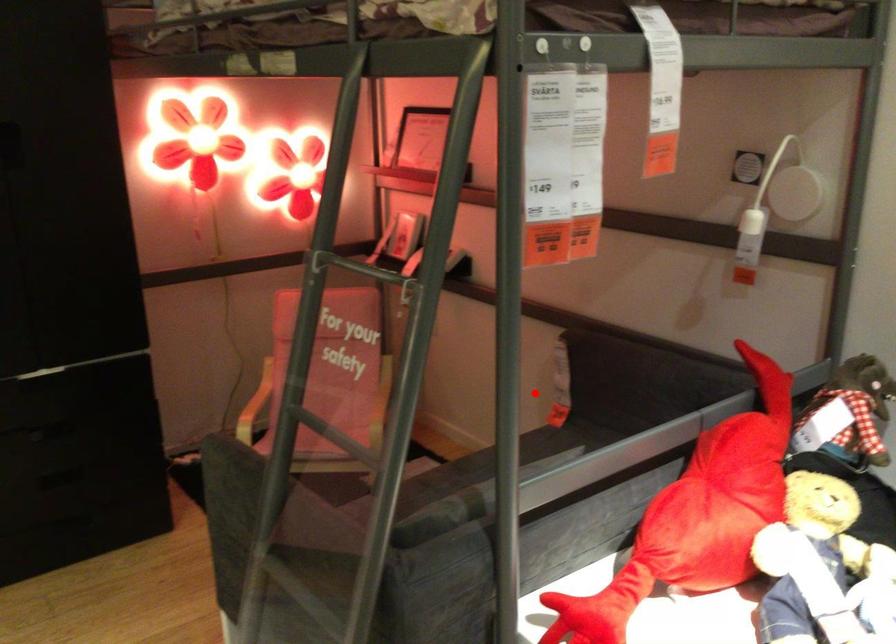
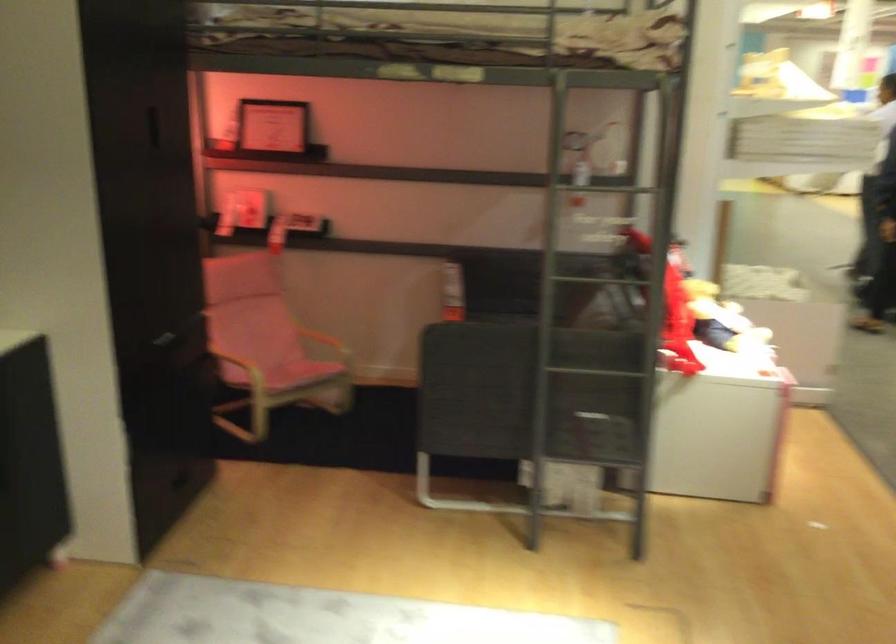
The point at the highlighted location is marked in the first image. Where is the corresponding point in the second image?

(452, 292)